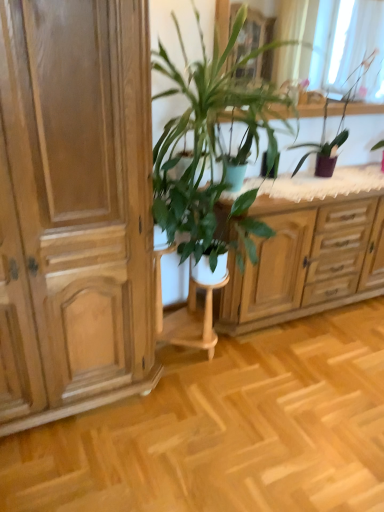
Question: From the image's perspective, is green matte flowerpot at center above or below purple glossy vase at upper right, which ranks as the second houseplant in left-to-right order?

Choices:
 (A) above
 (B) below

Answer: (B)

Question: From a real-world perspective, is green matte flowerpot at center positioned above or below purple glossy vase at upper right, which is the first houseplant from right to left?

Choices:
 (A) below
 (B) above

Answer: (A)

Question: Which object is the closest to the translucent fabric at upper center?

Choices:
 (A) green matte flowerpot at center
 (B) light wood cabinet at center
 (C) green leafy plant at center, which is the second houseplant in right-to-left order
 (D) purple glossy vase at upper right, which ranks as the second houseplant in left-to-right order
 (E) light brown wood cabinet at left

Answer: (D)

Question: Which object is the farthest from the light brown wood cabinet at left?

Choices:
 (A) purple glossy vase at upper right, which is the first houseplant from right to left
 (B) green matte flowerpot at center
 (C) translucent fabric at upper center
 (D) green leafy plant at center, which is the second houseplant in right-to-left order
 (E) light wood cabinet at center

Answer: (C)